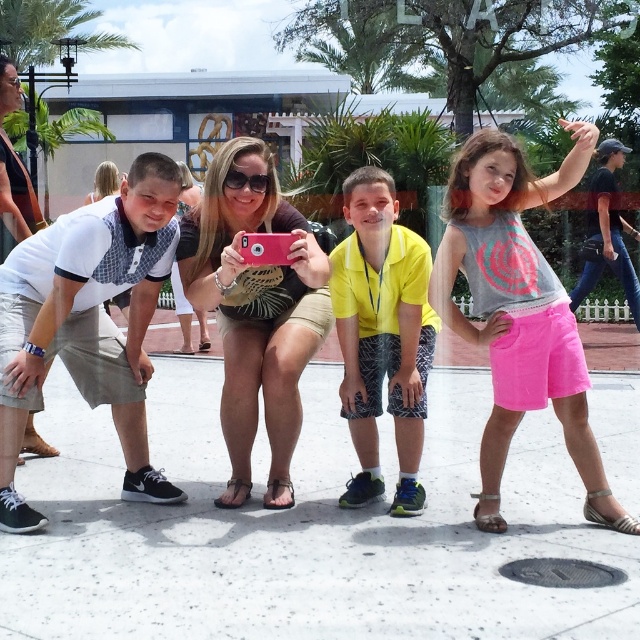
Question: Based on their relative distances, which object is nearer to the beige textured shorts at center?

Choices:
 (A) white textured polo shirt at left
 (B) pink cotton shorts at center

Answer: (A)

Question: Is white textured polo shirt at left wider than denim jeans at upper right?

Choices:
 (A) no
 (B) yes

Answer: (A)

Question: Which of the following is the closest to the observer?

Choices:
 (A) yellow fabric shirt at center
 (B) denim jeans at upper right

Answer: (A)

Question: Is white textured polo shirt at left in front of denim jeans at upper right?

Choices:
 (A) no
 (B) yes

Answer: (B)

Question: Can you confirm if yellow fabric shirt at center is positioned to the left of light gray shorts at left?

Choices:
 (A) yes
 (B) no

Answer: (B)

Question: Among these objects, which one is farthest from the camera?

Choices:
 (A) pink cotton shorts at center
 (B) beige textured shorts at center
 (C) denim jeans at upper right
 (D) yellow fabric shirt at center

Answer: (C)